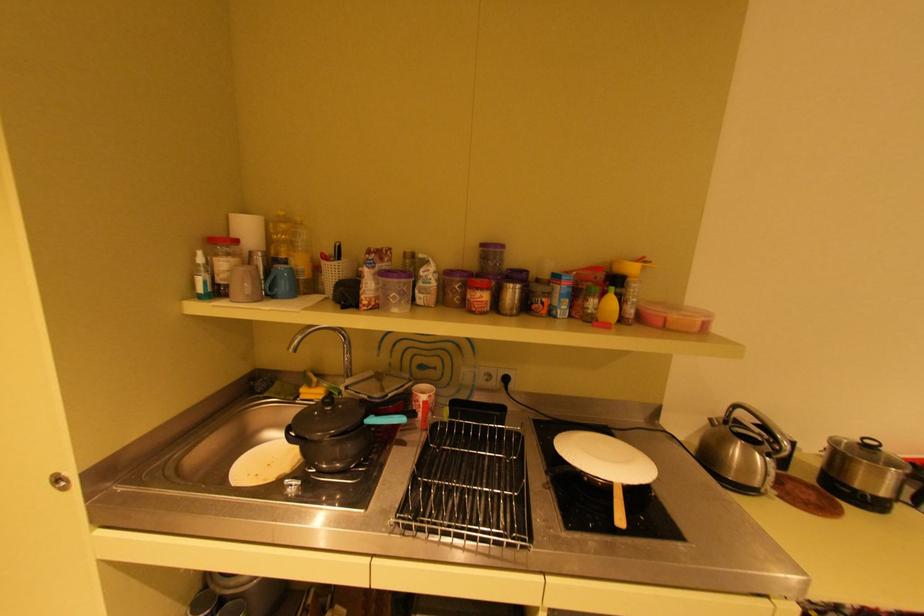
Where would you lift the black kettle handle? Please return your answer as a coordinate pair (x, y).

(917, 479)